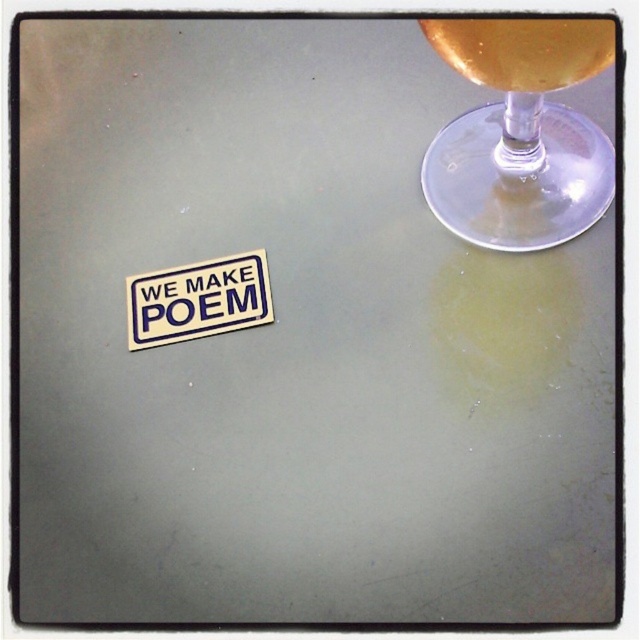
You are arranging items on a table. You have a transparent glass wine glass at upper right and a white paper sticker at lower left. According to the scene, where should you place the transparent glass wine glass relative to the white paper sticker?

The transparent glass wine glass at upper right should be placed to the right of the white paper sticker at lower left, as it is positioned to the right in the scene.

You are arranging items on a table and need to place both the transparent glass wine glass at upper right and the translucent glass at upper right. According to the scene, which glass is stacked on top of the other?

The translucent glass at upper right is stacked on top of the transparent glass wine glass at upper right because the transparent glass wine glass at upper right is positioned under the translucent glass at upper right.

You are setting up a table for a poetry reading event. You have a transparent glass wine glass at upper right and a white paper sticker at lower left. Which object should you place closer to the center of the table to ensure there is enough space for both items?

The transparent glass wine glass at upper right might be wider than the white paper sticker at lower left, so placing the sticker closer to the center would leave more space for the wider glass.